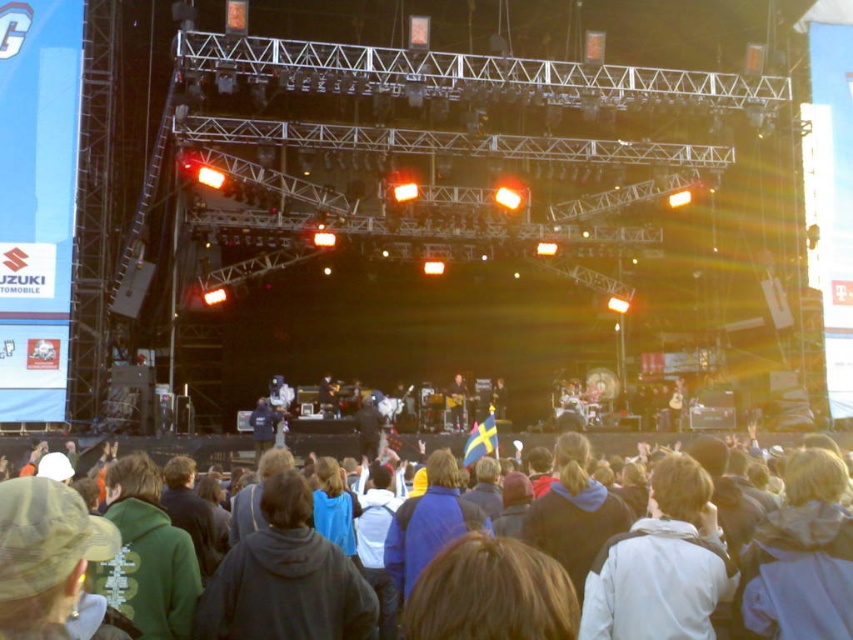
Question: Does dark gray hoodie at center appear on the right side of shiny black guitar at center?

Choices:
 (A) yes
 (B) no

Answer: (A)

Question: Which of the following is the closest to the observer?

Choices:
 (A) dark blue jacket at center
 (B) dark gray hoodie at center
 (C) shiny black guitar at center

Answer: (B)

Question: Is white matte jacket at center above dark blue jacket at center?

Choices:
 (A) no
 (B) yes

Answer: (A)

Question: Estimate the real-world distances between objects in this image. Which object is farther from the dark gray hoodie at center?

Choices:
 (A) dark blue jacket at center
 (B) shiny black guitar at center
 (C) white matte jacket at center

Answer: (A)

Question: Observing the image, what is the correct spatial positioning of dark gray hoodie at center in reference to dark blue jacket at center?

Choices:
 (A) below
 (B) above

Answer: (A)

Question: Which point is closer to the camera?

Choices:
 (A) shiny black guitar at center
 (B) dark blue jacket at center

Answer: (A)